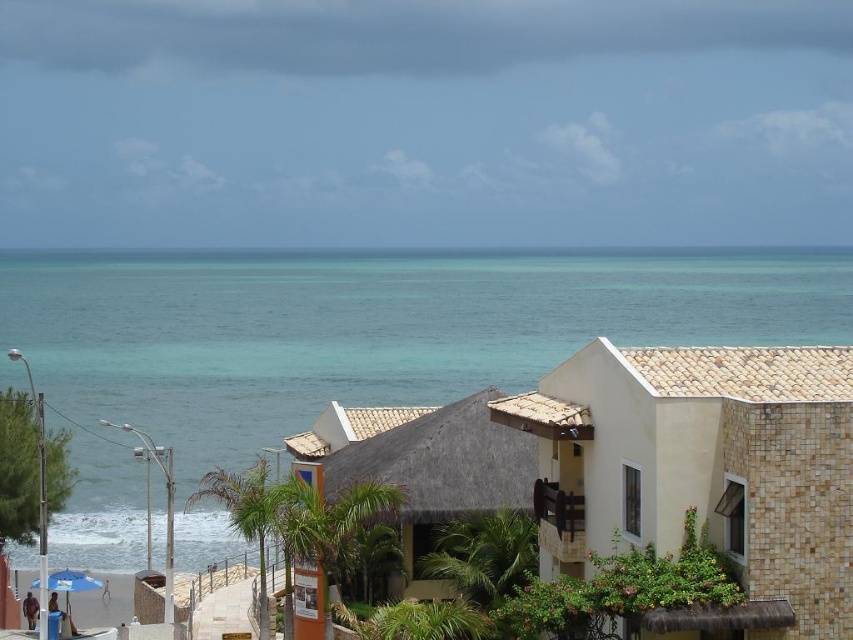
Can you confirm if turquoise water at center is positioned above beige tile house at right?

Correct, turquoise water at center is located above beige tile house at right.

Can you confirm if turquoise water at center is positioned below beige tile house at right?

No.

Who is more forward, (657, 280) or (608, 483)?

Point (608, 483) is more forward.

Locate an element on the screen. The width and height of the screenshot is (853, 640). turquoise water at center is located at coordinates (345, 348).

Who is lower down, beige tile house at right or thatched roof hut at center?

thatched roof hut at center is below.

Does beige tile house at right have a larger size compared to thatched roof hut at center?

Actually, beige tile house at right might be smaller than thatched roof hut at center.

Which is behind, point (596, 490) or point (405, 442)?

The point (405, 442) is behind.

Identify the location of beige tile house at right. This screenshot has height=640, width=853. (701, 474).

Is turquoise water at center smaller than thatched roof hut at center?

Incorrect, turquoise water at center is not smaller in size than thatched roof hut at center.

You are a GUI agent. You are given a task and a screenshot of the screen. Output one action in this format:
    pyautogui.click(x=<x>, y=<y>)
    Task: Click on the turquoise water at center
    The image size is (853, 640).
    Given the screenshot: What is the action you would take?
    pyautogui.click(x=345, y=348)

Locate an element on the screen. This screenshot has height=640, width=853. turquoise water at center is located at coordinates [345, 348].